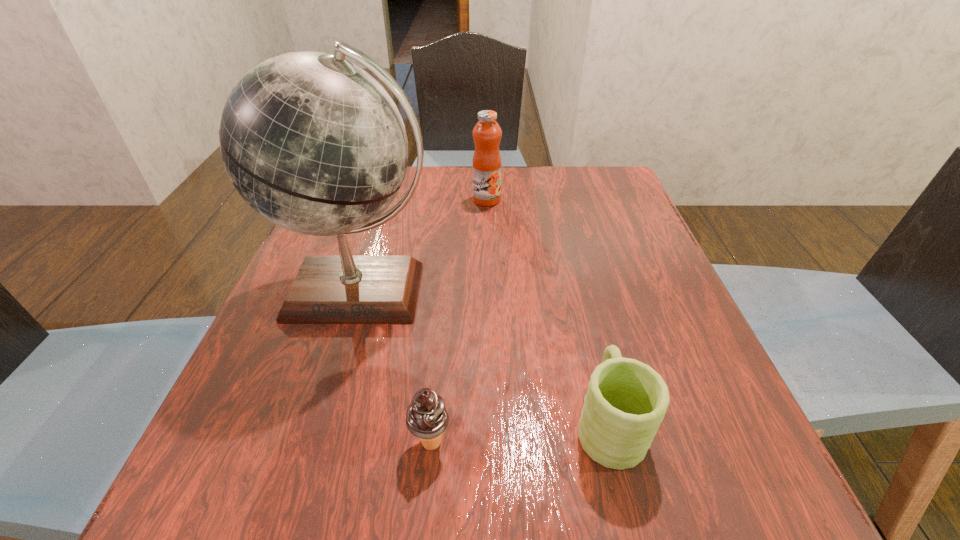
In the image, there is a desktop. Identify the location of vacant space at the left edge. (320, 369).

You are a GUI agent. You are given a task and a screenshot of the screen. Output one action in this format:
    pyautogui.click(x=<x>, y=<y>)
    Task: Click on the free space at the right edge of the desktop
    
    Given the screenshot: What is the action you would take?
    [x=659, y=277]

In order to click on blank space at the near left corner in this screenshot , I will do (x=254, y=524).

The width and height of the screenshot is (960, 540). In the image, there is a desktop. In order to click on vacant space at the near right corner in this screenshot , I will do `click(695, 478)`.

Find the location of a particular element. The image size is (960, 540). free space that is in between the tallest object and the fruit juice is located at coordinates (423, 246).

The image size is (960, 540). I want to click on vacant area between the tallest object and the third shortest object, so click(423, 246).

The width and height of the screenshot is (960, 540). In order to click on free space between the icecream and the farthest object in this screenshot , I will do point(459,321).

Find the location of `vacant area that lies between the rightmost object and the icecream`. vacant area that lies between the rightmost object and the icecream is located at coordinates (519, 433).

Where is `vacant region between the farthest object and the globe`? The width and height of the screenshot is (960, 540). vacant region between the farthest object and the globe is located at coordinates (423, 246).

Locate an element on the screen. This screenshot has height=540, width=960. free space between the fruit juice and the second farthest object is located at coordinates (423, 246).